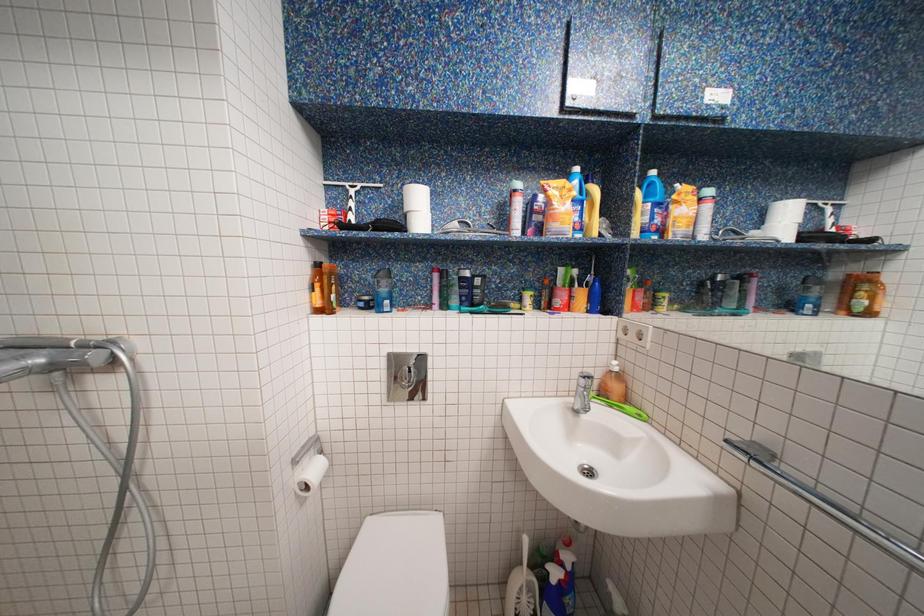
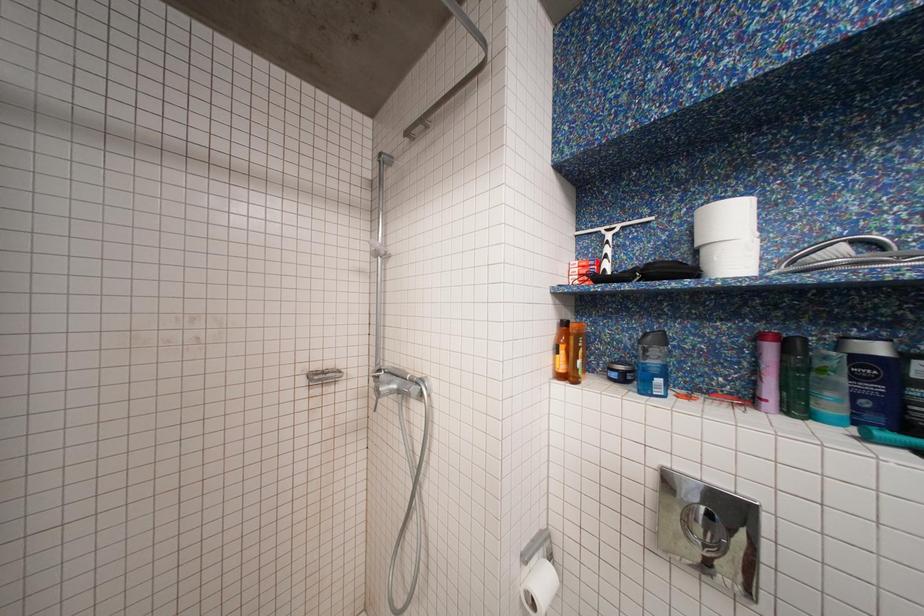
Question: The camera is either moving clockwise (left) or counter-clockwise (right) around the object. The first image is from the beginning of the video and the second image is from the end. Is the camera moving left or right when shooting the video?

Choices:
 (A) Left
 (B) Right

Answer: (B)